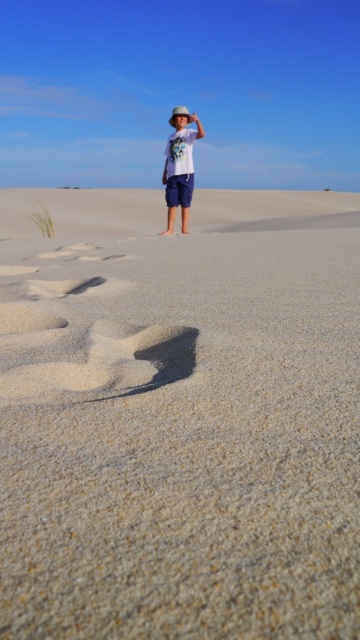
You are a photographer trying to capture the child in the desert scene. The child is wearing a white cotton shirt at center and has a brown sandy footprint at lower left. Which object is taller in the image?

The white cotton shirt at center is taller than the brown sandy footprint at lower left.